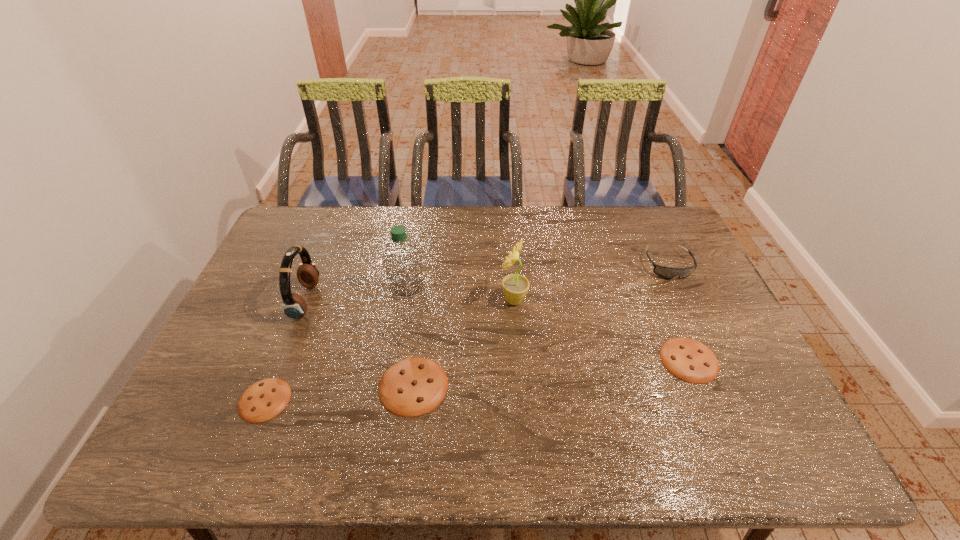
The height and width of the screenshot is (540, 960). Identify the location of the shortest cookie. (265, 399).

Locate an element on the screen. This screenshot has height=540, width=960. the leftmost cookie is located at coordinates (265, 399).

At what (x,y) coordinates should I click in order to perform the action: click on the second cookie from left to right. Please return your answer as a coordinate pair (x, y). Looking at the image, I should click on (414, 386).

The width and height of the screenshot is (960, 540). Identify the location of the second shortest cookie. (687, 359).

Find the location of a particular element. the rightmost cookie is located at coordinates (687, 359).

Identify the location of the fifth shortest object. This screenshot has height=540, width=960. (294, 306).

Where is `sunflower`? sunflower is located at coordinates (515, 286).

This screenshot has width=960, height=540. In order to click on goggles in this screenshot , I will do `click(665, 272)`.

Locate an element on the screen. This screenshot has height=540, width=960. water bottle is located at coordinates (402, 259).

This screenshot has height=540, width=960. Find the location of `vacant space situated 0.230m on the back of the shortest object`. vacant space situated 0.230m on the back of the shortest object is located at coordinates (300, 312).